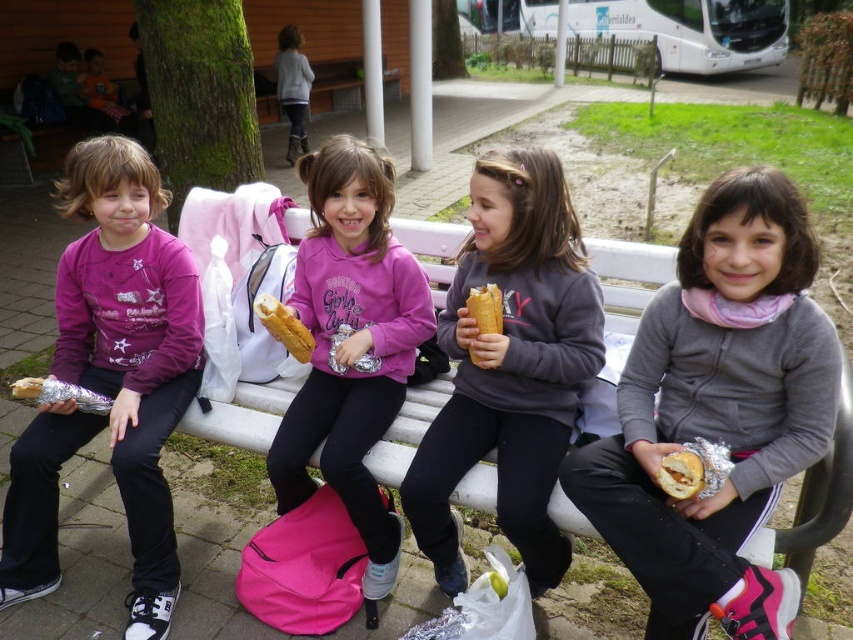
You are a photographer trying to capture a photo of the matte purple sweatshirt at left and the golden brown bread at center. Based on their sizes, which object should you focus on first to ensure both are in frame without moving the camera?

The matte purple sweatshirt at left is taller than the golden brown bread at center, so you should focus on the matte purple sweatshirt at left first to ensure both fit in the frame without moving the camera.

You are a photographer standing in front of the gray fleece jacket at center. You want to take a photo of it without moving closer than 1.3 meters. Is your current position sufficient?

The distance between you and the gray fleece jacket at center is 1.41 meters, which is greater than the 1.3 meters required. Therefore, your current position is sufficient to take the photo without moving closer.